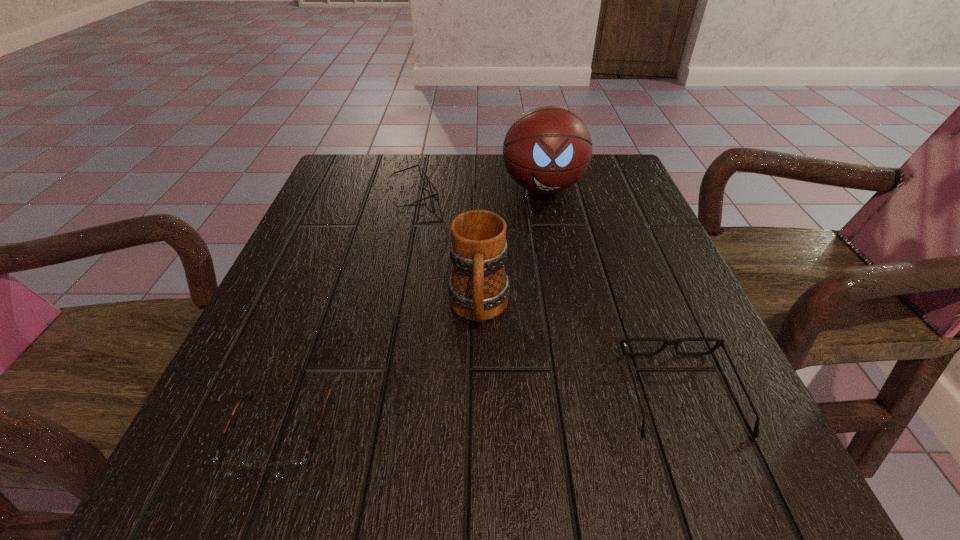
I want to click on vacant space at the left edge, so click(275, 336).

Identify the location of vacant space at the right edge of the desktop. (626, 232).

The image size is (960, 540). I want to click on free space at the far left corner of the desktop, so click(340, 185).

Where is `vacant region at the far right corner of the desktop`? The width and height of the screenshot is (960, 540). vacant region at the far right corner of the desktop is located at coordinates (609, 191).

At what (x,y) coordinates should I click in order to perform the action: click on vacant area between the rightmost spectacles and the mug. Please return your answer as a coordinate pair (x, y). Looking at the image, I should click on (580, 351).

Identify the location of free area in between the basketball and the third farthest object. This screenshot has height=540, width=960. (511, 248).

This screenshot has width=960, height=540. What are the coordinates of `vacant area between the rightmost spectacles and the third object from left to right` in the screenshot? It's located at (580, 351).

Identify the location of free space between the third farthest object and the rightmost spectacles. This screenshot has width=960, height=540. (580, 351).

Identify the location of free space that is in between the rightmost spectacles and the tallest object. (612, 291).

This screenshot has height=540, width=960. What are the coordinates of `free space that is in between the tallest object and the second tallest object` in the screenshot? It's located at (511, 248).